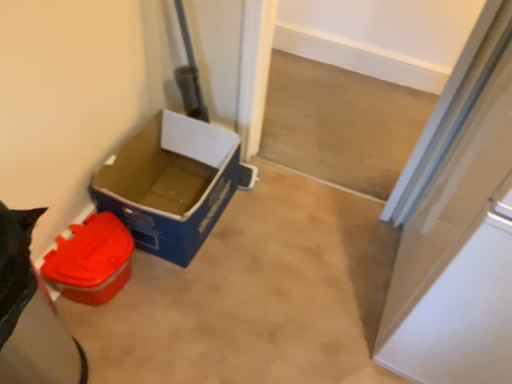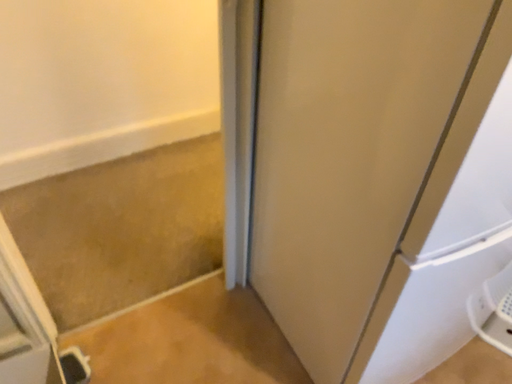
Question: Which way did the camera rotate in the video?

Choices:
 (A) rotated downward
 (B) rotated upward

Answer: (B)